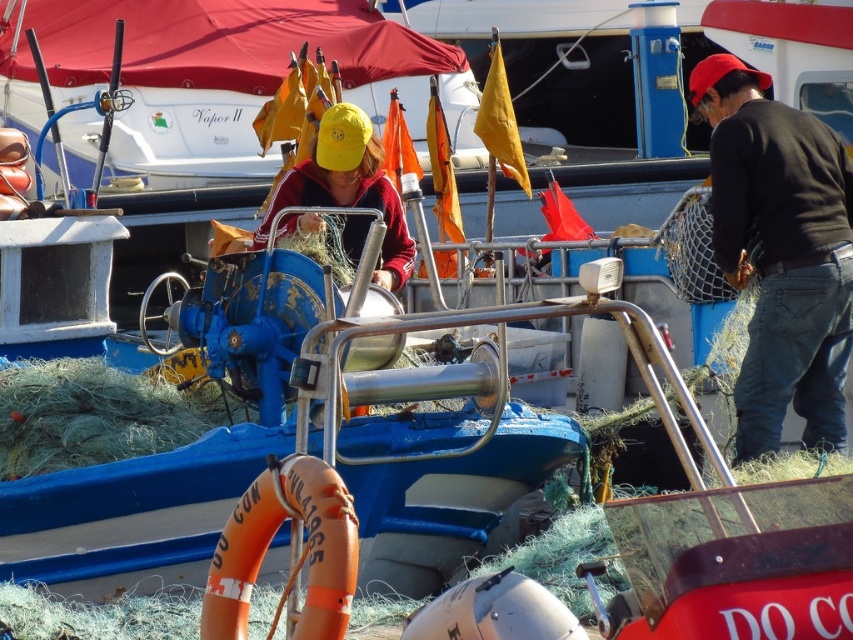
You are a safety inspector checking the placement of the black cotton shirt at right and the orange rubber life jacket at lower center on the boat deck. According to safety regulations, the life jacket must be easily accessible and not obstructed by other items. Does the current arrangement comply with safety standards?

The black cotton shirt at right is taller than the orange rubber life jacket at lower center, which means the shirt could be blocking access to the life jacket. This violates safety regulations as the orange rubber life jacket at lower center must remain unobstructed and easily reachable.

You are a safety inspector checking the boat. You notice the orange rubber life jacket at lower center and the matte red jacket at center. According to safety regulations, life jackets must be placed to the left of any personal clothing items. Is the current arrangement compliant?

The orange rubber life jacket at lower center is positioned on the right side of matte red jacket at center, which is personal clothing. Since safety regulations require life jackets to be placed to the left of personal clothing items, the current arrangement is not compliant.

You are a safety inspector checking the placement of safety equipment on the boat. The black cotton shirt at right and the orange rubber life jacket at lower center are both visible from your vantage point. Which item is located to the right of the other?

The black cotton shirt at right is positioned on the right side of orange rubber life jacket at lower center, so the black cotton shirt at right is to the right of the orange rubber life jacket at lower center.